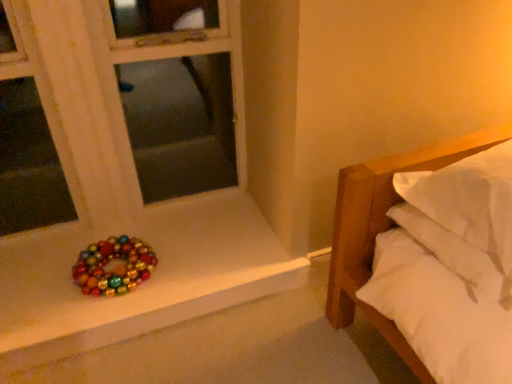
Where is `free spot to the right of glossy multicolored beads at lower left`? The width and height of the screenshot is (512, 384). free spot to the right of glossy multicolored beads at lower left is located at coordinates (184, 264).